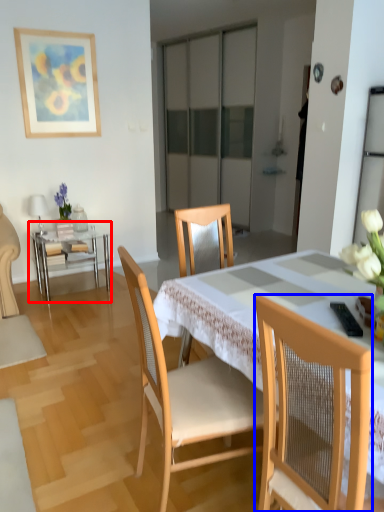
Question: Which object appears closest to the camera in this image, table (highlighted by a red box) or chair (highlighted by a blue box)?

Choices:
 (A) table
 (B) chair

Answer: (B)